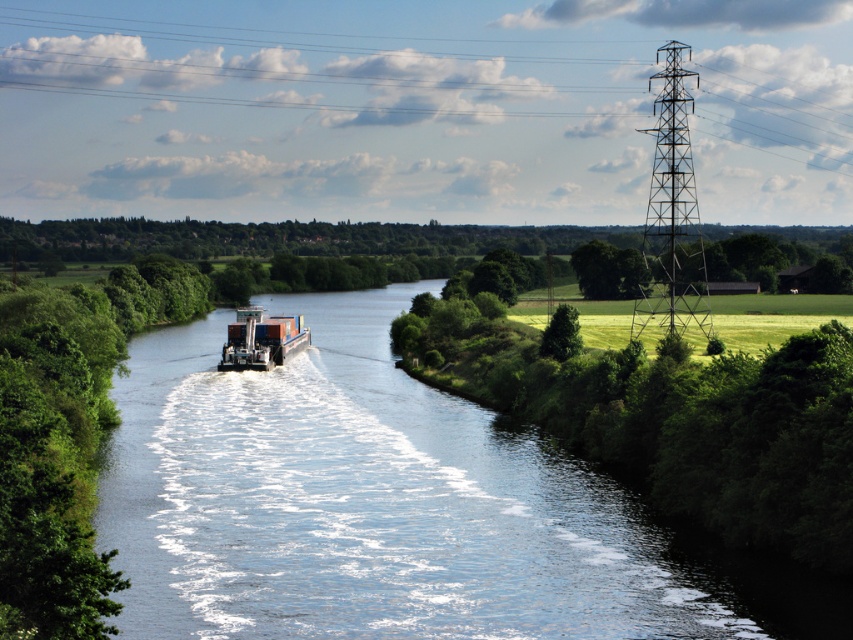
You are standing at the edge of the river and see two points marked in the scene. Which point is closer to you, point (554, 12) or point (254, 323)?

Result: Point (554, 12) is closer to you because it is further to the viewer than point (254, 323).

Consider the image. You are a photographer planning to capture the metallic tower at upper center and the metallic container ship at center in the same frame. Considering their sizes, which object will appear larger in the photo?

The metallic tower at upper center is much taller than the metallic container ship at center, so it will appear larger in the photo.

You are a photographer planning to capture the clear blue water at center and the metallic tower at upper center in a single shot. Based on their heights, which object would appear taller in the photograph?

The metallic tower at upper center is taller than the clear blue water at center, so it would appear taller in the photograph.